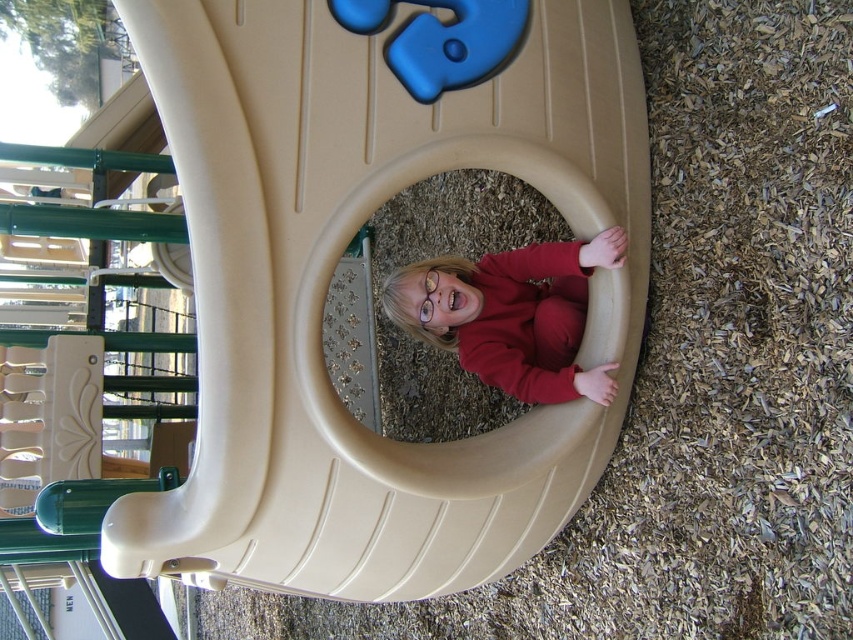
You are a parent supervising a child at the playground. You notice the tan plastic slide at center and the matte red sweater at center. Which object is positioned higher from the ground?

The tan plastic slide at center is above matte red sweater at center, so the slide is higher up.

You are a parent trying to locate your child in the playground. You see the tan plastic slide at center and the matte red sweater at center. Which object is positioned to the left?

The tan plastic slide at center is to the left of matte red sweater at center, so the slide is positioned to the left.

You are a parent trying to ensure your child can safely reach the top of the tan plastic slide at center while wearing the matte red sweater at center. Based on the height comparison between the two, is the slide accessible for the child?

The tan plastic slide at center is much taller than the matte red sweater at center, so the slide may be too high for the child to reach the top safely without assistance.